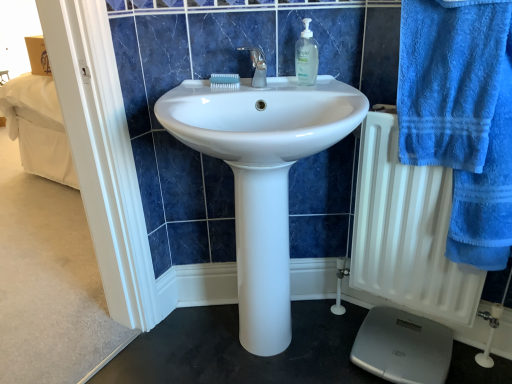
Question: Is the depth of gray plastic scale at lower right less than that of blue terry cloth towel at right?

Choices:
 (A) no
 (B) yes

Answer: (A)

Question: Is gray plastic scale at lower right with blue terry cloth towel at right?

Choices:
 (A) no
 (B) yes

Answer: (A)

Question: From a real-world perspective, is gray plastic scale at lower right below blue terry cloth towel at right?

Choices:
 (A) no
 (B) yes

Answer: (B)

Question: Does gray plastic scale at lower right have a greater height compared to blue terry cloth towel at right?

Choices:
 (A) no
 (B) yes

Answer: (A)

Question: Does gray plastic scale at lower right have a lesser width compared to blue terry cloth towel at right?

Choices:
 (A) yes
 (B) no

Answer: (B)

Question: Is white glossy sink at center in front of or behind blue terry cloth towel at right in the image?

Choices:
 (A) behind
 (B) front

Answer: (A)

Question: Is point (269, 273) closer or farther from the camera than point (402, 119)?

Choices:
 (A) closer
 (B) farther

Answer: (B)

Question: Is white glossy sink at center wider or thinner than blue terry cloth towel at right?

Choices:
 (A) wide
 (B) thin

Answer: (A)

Question: Which is correct: white glossy sink at center is inside blue terry cloth towel at right, or outside of it?

Choices:
 (A) inside
 (B) outside

Answer: (B)

Question: Based on their sizes in the image, would you say clear plastic soap dispenser at upper center is bigger or smaller than white matte radiator at right?

Choices:
 (A) small
 (B) big

Answer: (A)

Question: Is clear plastic soap dispenser at upper center taller or shorter than white matte radiator at right?

Choices:
 (A) short
 (B) tall

Answer: (A)

Question: In terms of width, does clear plastic soap dispenser at upper center look wider or thinner when compared to white matte radiator at right?

Choices:
 (A) thin
 (B) wide

Answer: (A)

Question: Considering the positions of point click(310, 36) and point click(433, 296), is point click(310, 36) closer or farther from the camera than point click(433, 296)?

Choices:
 (A) closer
 (B) farther

Answer: (A)

Question: In terms of size, does white matte radiator at right appear bigger or smaller than clear plastic soap dispenser at upper center?

Choices:
 (A) big
 (B) small

Answer: (A)

Question: Considering the positions of white matte radiator at right and clear plastic soap dispenser at upper center in the image, is white matte radiator at right taller or shorter than clear plastic soap dispenser at upper center?

Choices:
 (A) short
 (B) tall

Answer: (B)